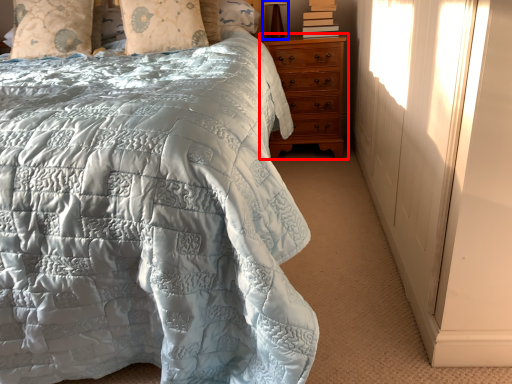
Question: Which object is closer to the camera taking this photo, chest of drawers (highlighted by a red box) or table lamp (highlighted by a blue box)?

Choices:
 (A) chest of drawers
 (B) table lamp

Answer: (A)